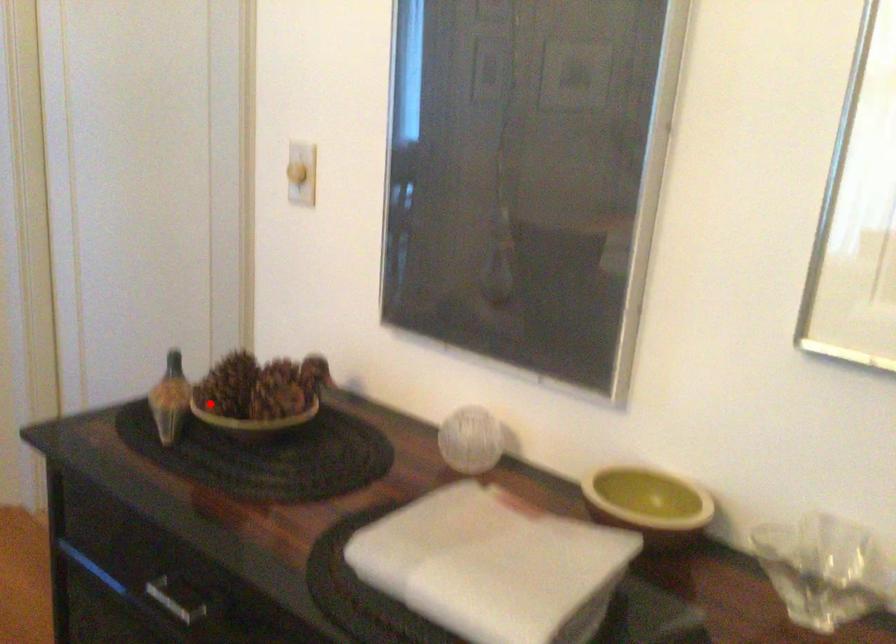
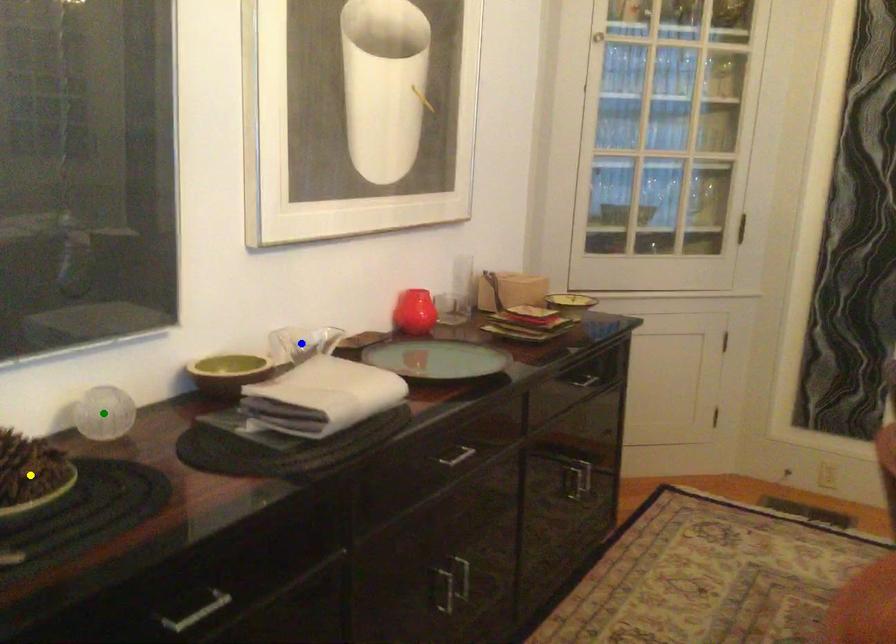
Question: I am providing you with two images of the same scene from different viewpoints. A red point is marked on the first image. You are given multiple points on the second image. Which point in image 2 represents the same 3d spot as the red point in image 1?

Choices:
 (A) blue point
 (B) green point
 (C) yellow point

Answer: (C)